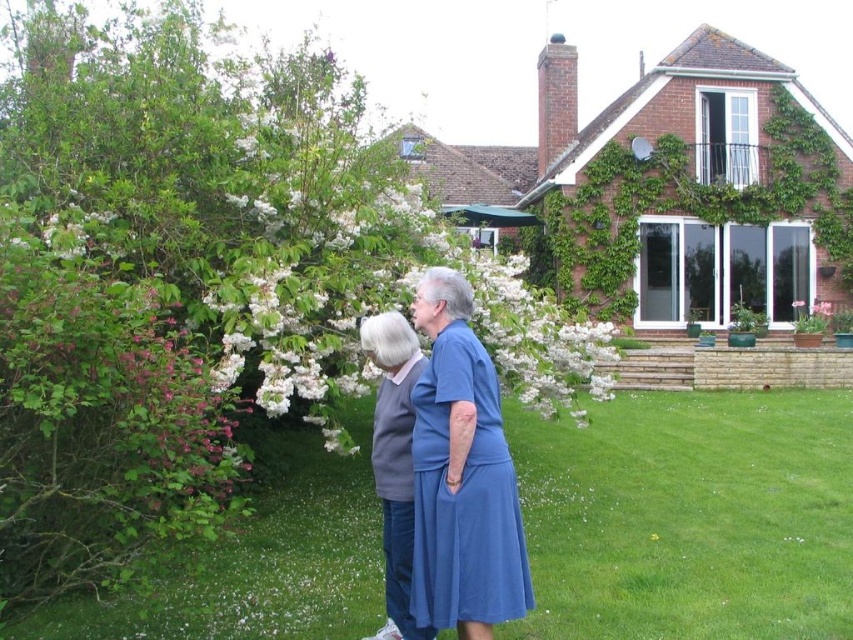
Question: Which object appears closest to the camera in this image?

Choices:
 (A) blue fabric dress at center
 (B) pink matte flower at center

Answer: (A)

Question: Is green grass at center positioned at the back of pink matte flower at center?

Choices:
 (A) no
 (B) yes

Answer: (A)

Question: Is pink glossy bush at left thinner than pink matte flower at center?

Choices:
 (A) no
 (B) yes

Answer: (A)

Question: Is pink glossy bush at left behind blue fabric dress at center?

Choices:
 (A) yes
 (B) no

Answer: (B)

Question: Which point appears farthest from the camera in this image?

Choices:
 (A) (273, 353)
 (B) (462, 486)
 (C) (627, 444)
 (D) (103, 428)

Answer: (C)

Question: Which is nearer to the green grass at center?

Choices:
 (A) white blossoms at upper center
 (B) pink matte flower at center
 (C) blue fabric dress at center
 (D) pink glossy bush at left

Answer: (D)